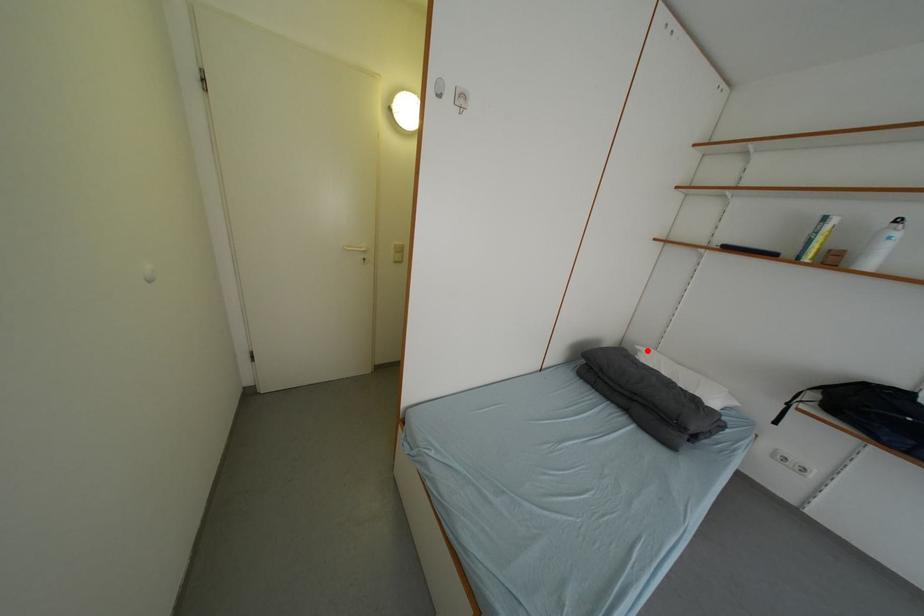
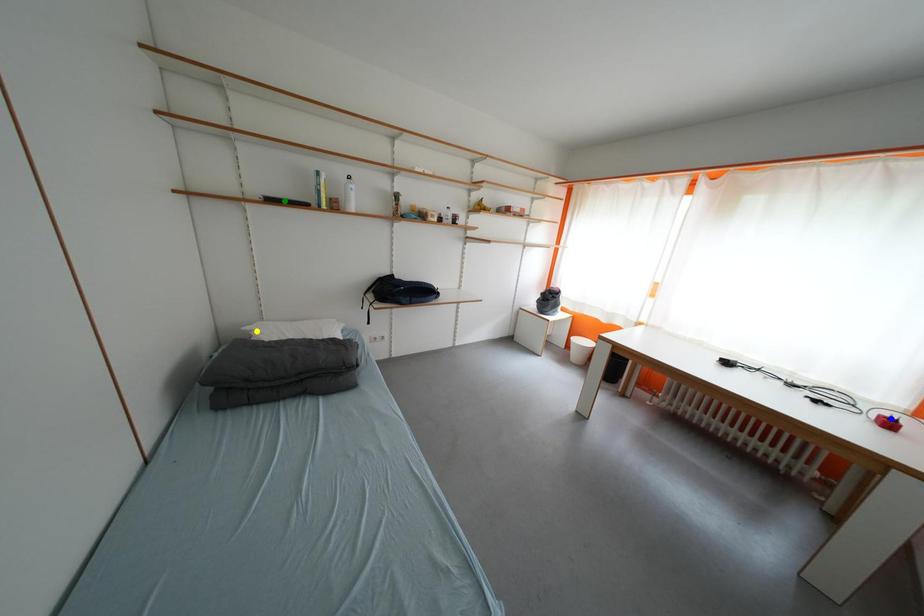
Question: I am providing you with two images of the same scene from different viewpoints. A red point is marked on the first image. You are given multiple points on the second image. Which mark in image 2 goes with the point in image 1?

Choices:
 (A) yellow point
 (B) blue point
 (C) green point

Answer: (A)